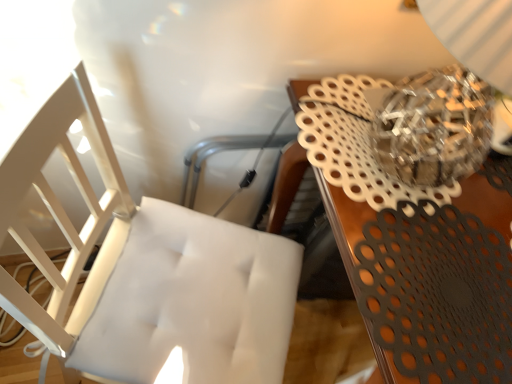
Question: From the image's perspective, is white tufted cushion at left located beneath metallic brown table at upper right?

Choices:
 (A) no
 (B) yes

Answer: (B)

Question: Is white tufted cushion at left thinner than metallic brown table at upper right?

Choices:
 (A) no
 (B) yes

Answer: (B)

Question: Does white tufted cushion at left lie in front of metallic brown table at upper right?

Choices:
 (A) no
 (B) yes

Answer: (B)

Question: Would you consider white tufted cushion at left to be distant from metallic brown table at upper right?

Choices:
 (A) no
 (B) yes

Answer: (A)

Question: From a real-world perspective, is white tufted cushion at left physically above metallic brown table at upper right?

Choices:
 (A) yes
 (B) no

Answer: (A)

Question: Can you confirm if white tufted cushion at left is positioned to the left of metallic brown table at upper right?

Choices:
 (A) no
 (B) yes

Answer: (B)

Question: From a real-world perspective, is metallic brown table at upper right located beneath white tufted cushion at left?

Choices:
 (A) yes
 (B) no

Answer: (A)

Question: Would you say metallic brown table at upper right is outside white tufted cushion at left?

Choices:
 (A) no
 (B) yes

Answer: (B)

Question: Is the depth of metallic brown table at upper right less than that of white tufted cushion at left?

Choices:
 (A) no
 (B) yes

Answer: (A)

Question: Does metallic brown table at upper right have a smaller size compared to white tufted cushion at left?

Choices:
 (A) no
 (B) yes

Answer: (A)

Question: Is metallic brown table at upper right further to the viewer compared to white tufted cushion at left?

Choices:
 (A) no
 (B) yes

Answer: (B)

Question: Does metallic brown table at upper right have a greater height compared to white tufted cushion at left?

Choices:
 (A) no
 (B) yes

Answer: (A)

Question: Is metallic brown table at upper right taller or shorter than white tufted cushion at left?

Choices:
 (A) tall
 (B) short

Answer: (B)